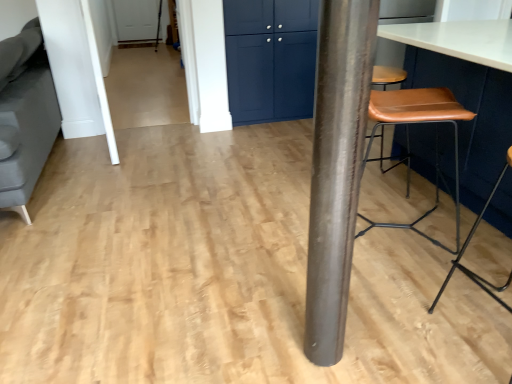
Where is `vacant space behind brown leather stool at right`? vacant space behind brown leather stool at right is located at coordinates (389, 183).